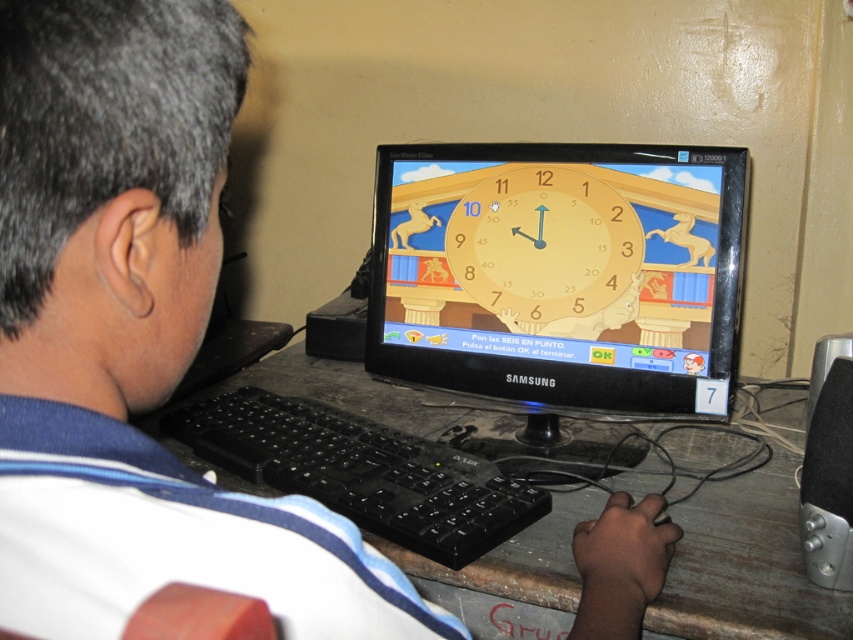
You are trying to place a new monitor stand on the wooden desk at center. The stand requires a minimum space of 20 cm between the edges of the desk and the yellow matte clock at center. Can the stand be placed on the desk?

The wooden desk at center is wider than the yellow matte clock at center, but the exact dimensions are not provided. Without knowing the desk width or the clock position, it is impossible to determine if there is enough space for the stand.

What are the coordinates of the matte plastic monitor at center?

The coordinates of the matte plastic monitor at center are point (560, 273).

You are a delivery person who needs to place a 30 cm long package between the black plastic keyboard at center and the yellow matte clock at center on the desk. Based on the desk layout shown in the image, will the package fit between them without overlapping either object?

The distance between the black plastic keyboard at center and the yellow matte clock at center is 29.34 centimeters. Since the package is 30 cm long, it will not fit between them without overlapping either object.